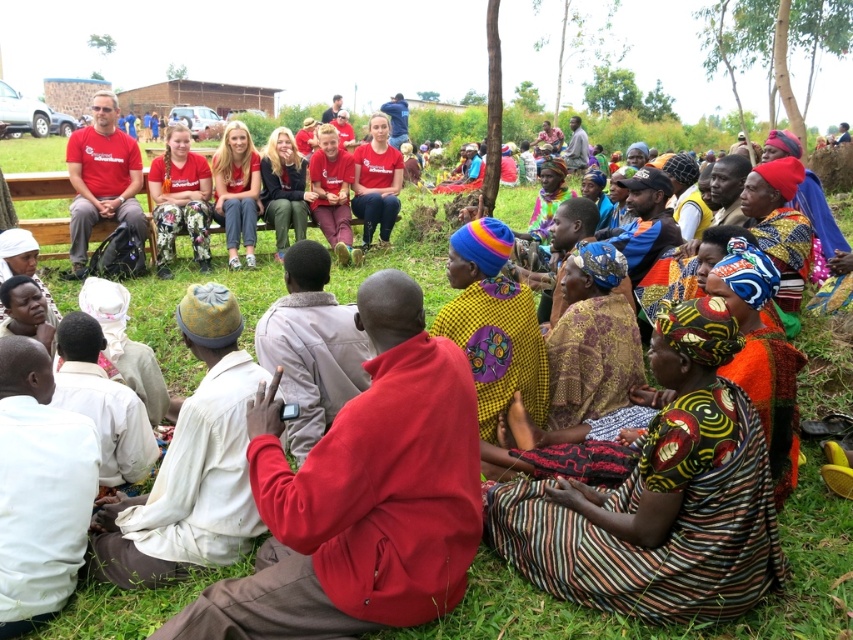
Question: Where is patterned fabric dress at center located in relation to matte black jacket at center in the image?

Choices:
 (A) left
 (B) right

Answer: (B)

Question: Is yellow printed fabric at center further to the viewer compared to floral leggings at center?

Choices:
 (A) yes
 (B) no

Answer: (B)

Question: Which point is closer to the camera?

Choices:
 (A) (752, 216)
 (B) (697, 531)
 (C) (532, 371)

Answer: (B)

Question: Which point is farther to the camera?

Choices:
 (A) (274, 182)
 (B) (560, 426)
 (C) (753, 186)

Answer: (A)

Question: Estimate the real-world distances between objects in this image. Which object is closer to the matte red shirt at center?

Choices:
 (A) floral leggings at center
 (B) yellow printed fabric at center

Answer: (A)

Question: Is multicolored woven cloth at center positioned behind floral leggings at center?

Choices:
 (A) no
 (B) yes

Answer: (A)